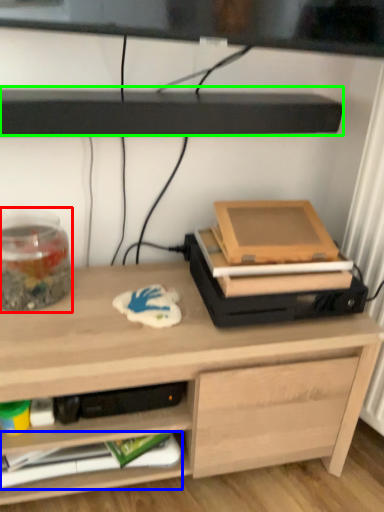
Question: Which is nearer to the glass jar (highlighted by a red box)? paperback book (highlighted by a blue box) or shelf (highlighted by a green box).

Choices:
 (A) paperback book
 (B) shelf

Answer: (B)